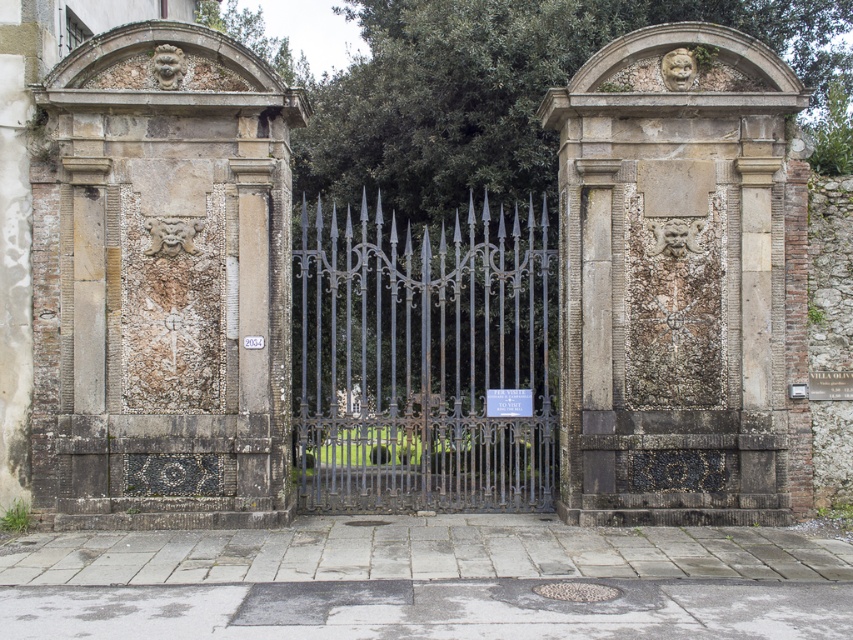
Question: Can you confirm if stone textured face at center is positioned below black wrought iron gate at center?

Choices:
 (A) yes
 (B) no

Answer: (B)

Question: Which object is the closest to the black wrought iron gate at center?

Choices:
 (A) stone textured face at center
 (B) stone mosaic wall at left

Answer: (A)

Question: Which object is farther from the camera taking this photo?

Choices:
 (A) stone mosaic wall at left
 (B) stone textured face at center

Answer: (B)

Question: Does stone mosaic wall at left have a lesser width compared to stone textured face at center?

Choices:
 (A) yes
 (B) no

Answer: (A)

Question: Which point is farther to the camera?

Choices:
 (A) (323, 358)
 (B) (693, 177)
 (C) (32, 436)

Answer: (A)

Question: Considering the relative positions of stone mosaic wall at left and black wrought iron gate at center in the image provided, where is stone mosaic wall at left located with respect to black wrought iron gate at center?

Choices:
 (A) left
 (B) right

Answer: (A)